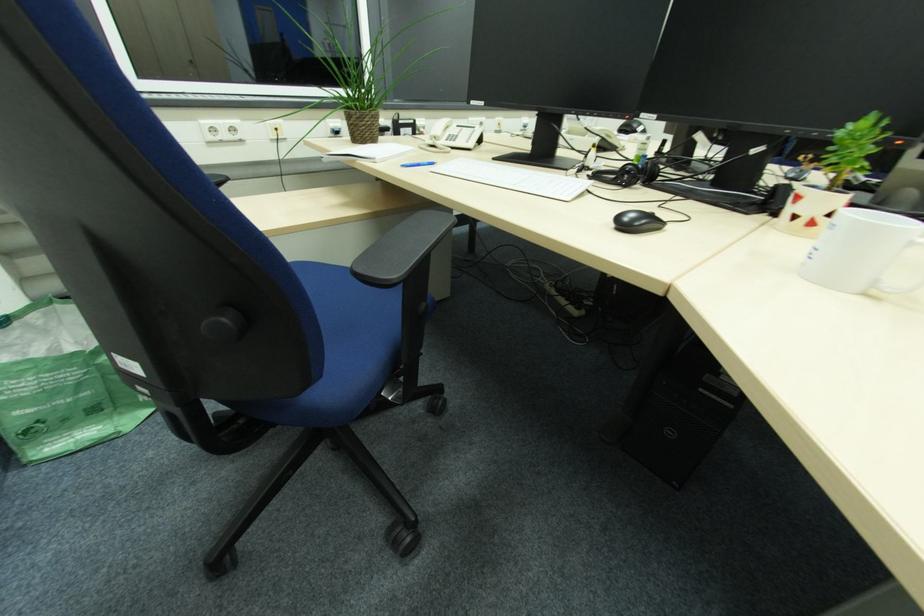
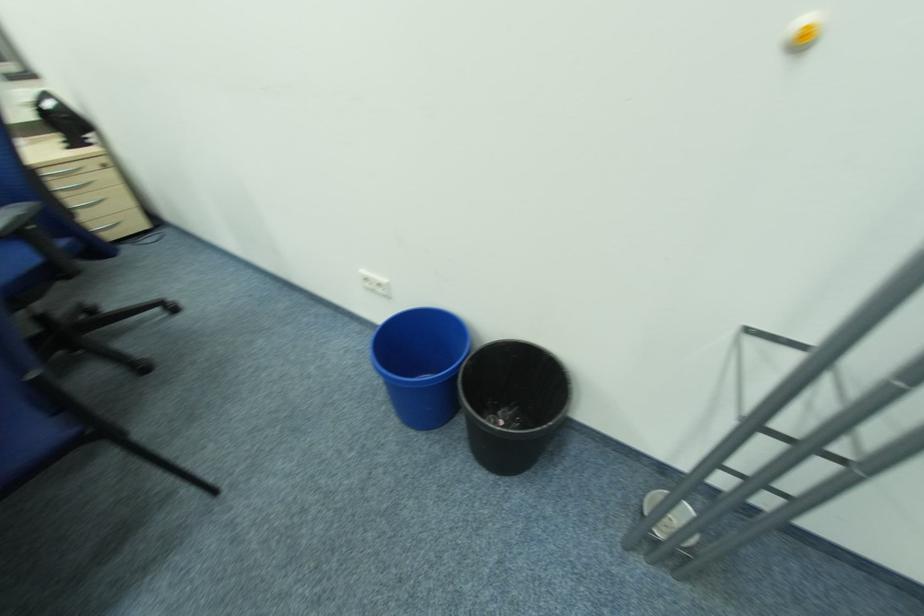
Question: The images are taken continuously from a first-person perspective. In which direction are you moving?

Choices:
 (A) Left
 (B) Right
 (C) Forward
 (D) Backward

Answer: (B)